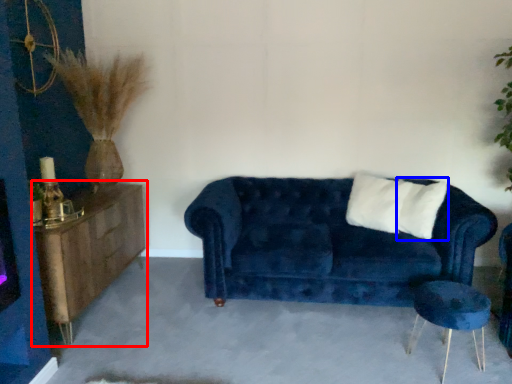
Question: Which of the following is the farthest to the observer, dresser (highlighted by a red box) or pillow (highlighted by a blue box)?

Choices:
 (A) dresser
 (B) pillow

Answer: (B)